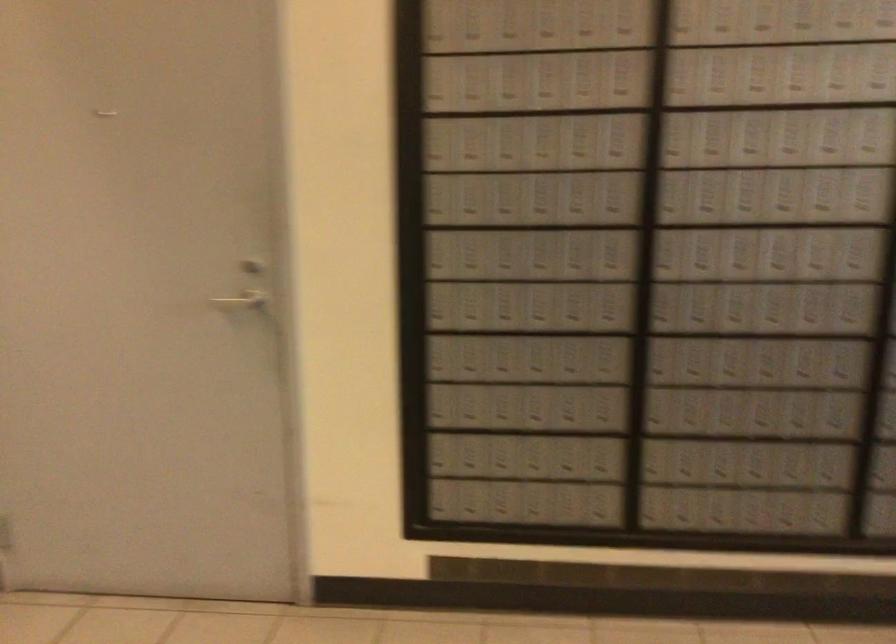
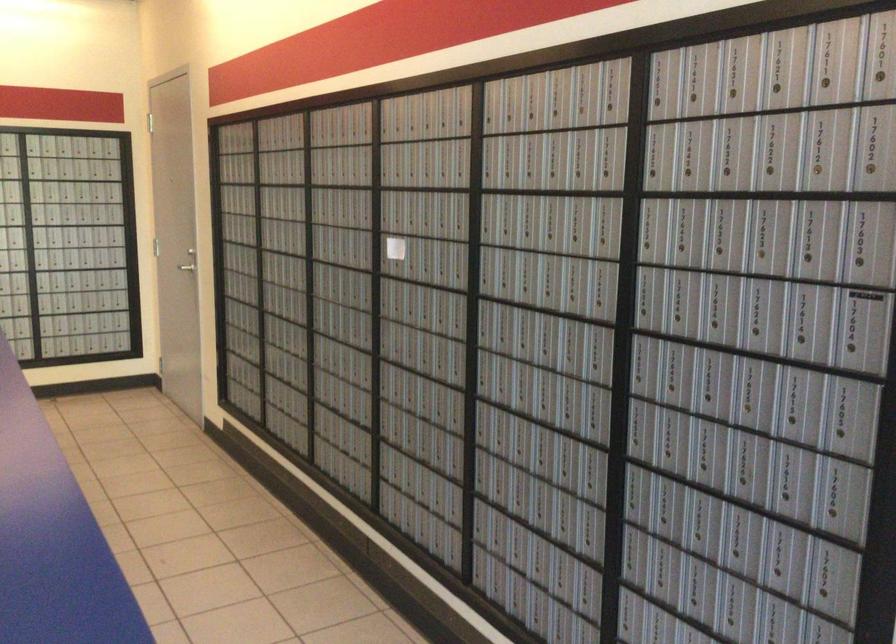
Find the pixel in the second image that matches pixel 160 259 in the first image.

(176, 241)